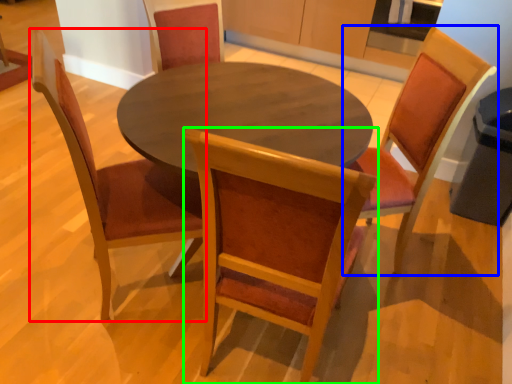
Question: Based on their relative distances, which object is farther from chair (highlighted by a red box)? Choose from chair (highlighted by a blue box) and chair (highlighted by a green box).

Choices:
 (A) chair
 (B) chair

Answer: (A)